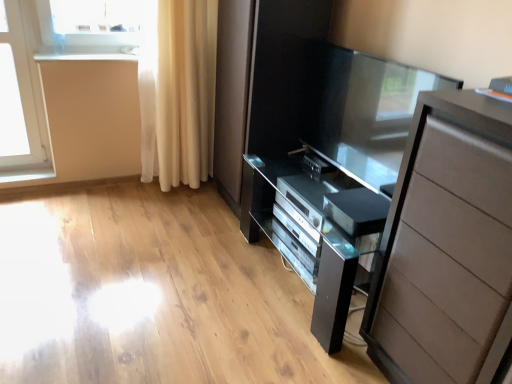
Question: Can you confirm if matte brown chest of drawers at right is wider than satin silver dvd player at lower center, the 2th appliance in the back-to-front sequence?

Choices:
 (A) no
 (B) yes

Answer: (B)

Question: Considering the relative sizes of matte brown chest of drawers at right and satin silver dvd player at lower center, the 2th appliance in the back-to-front sequence, in the image provided, is matte brown chest of drawers at right smaller than satin silver dvd player at lower center, the 2th appliance in the back-to-front sequence,?

Choices:
 (A) no
 (B) yes

Answer: (A)

Question: Is satin silver dvd player at lower center, the 1th appliance when ordered from bottom to top, surrounded by matte brown chest of drawers at right?

Choices:
 (A) no
 (B) yes

Answer: (A)

Question: Would you say matte brown chest of drawers at right is outside satin silver dvd player at lower center, the 1th appliance from the front?

Choices:
 (A) no
 (B) yes

Answer: (B)

Question: Can you confirm if matte brown chest of drawers at right is shorter than satin silver dvd player at lower center, arranged as the 2th appliance when viewed from the top?

Choices:
 (A) yes
 (B) no

Answer: (B)

Question: Looking at their shapes, would you say matte brown chest of drawers at right is wider or thinner than satin black tv at center, which ranks as the 2th appliance in front-to-back order?

Choices:
 (A) wide
 (B) thin

Answer: (A)

Question: Is point (429, 96) positioned closer to the camera than point (329, 165)?

Choices:
 (A) farther
 (B) closer

Answer: (B)

Question: From the image's perspective, is matte brown chest of drawers at right positioned above or below satin black tv at center, the 1th appliance viewed from the back?

Choices:
 (A) below
 (B) above

Answer: (A)

Question: Which is correct: matte brown chest of drawers at right is inside satin black tv at center, the 1th appliance viewed from the back, or outside of it?

Choices:
 (A) inside
 (B) outside

Answer: (B)

Question: Is satin silver dvd player at lower center, the 2th appliance in the back-to-front sequence, inside or outside of satin black tv at center, the second appliance from the bottom?

Choices:
 (A) inside
 (B) outside

Answer: (B)

Question: Is satin silver dvd player at lower center, arranged as the 2th appliance when viewed from the top, taller or shorter than satin black tv at center, which ranks as the 2th appliance in front-to-back order?

Choices:
 (A) tall
 (B) short

Answer: (A)

Question: Does point (352, 236) appear closer or farther from the camera than point (323, 160)?

Choices:
 (A) closer
 (B) farther

Answer: (A)

Question: In terms of width, does satin silver dvd player at lower center, the 1th appliance when ordered from bottom to top, look wider or thinner when compared to satin black tv at center, which is the 1th appliance in top-to-bottom order?

Choices:
 (A) thin
 (B) wide

Answer: (B)

Question: Relative to light beige sheer curtain at left, is white glossy window sill at upper left in front or behind?

Choices:
 (A) behind
 (B) front

Answer: (A)

Question: Is white glossy window sill at upper left taller or shorter than light beige sheer curtain at left?

Choices:
 (A) short
 (B) tall

Answer: (A)